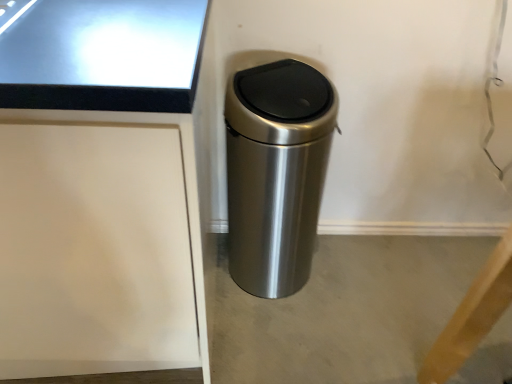
Where is `satin silver trash can at center`? satin silver trash can at center is located at coordinates tap(276, 172).

The width and height of the screenshot is (512, 384). What do you see at coordinates (276, 172) in the screenshot? I see `satin silver trash can at center` at bounding box center [276, 172].

Measure the distance between point [259,247] and camera.

The depth of point [259,247] is 3.98 feet.

In order to face satin silver trash can at center, should I rotate leftwards or rightwards?

A 2.745 degree turn to the right will do.

Image resolution: width=512 pixels, height=384 pixels. What do you see at coordinates (342, 310) in the screenshot?
I see `gray concrete at center` at bounding box center [342, 310].

Locate an element on the screen. This screenshot has height=384, width=512. gray concrete at center is located at coordinates (342, 310).

Locate an element on the screen. satin silver trash can at center is located at coordinates (276, 172).

Considering the relative positions of gray concrete at center and satin silver trash can at center in the image provided, is gray concrete at center to the right of satin silver trash can at center from the viewer's perspective?

Yes, gray concrete at center is to the right of satin silver trash can at center.

Who is more distant, gray concrete at center or satin silver trash can at center?

Positioned behind is gray concrete at center.

Does point (275, 341) come in front of point (259, 211)?

No, (275, 341) is further to viewer.

From the image's perspective, does gray concrete at center appear lower than satin silver trash can at center?

Yes.

From a real-world perspective, is gray concrete at center below satin silver trash can at center?

Correct, in the physical world, gray concrete at center is lower than satin silver trash can at center.

Considering the relative sizes of gray concrete at center and satin silver trash can at center in the image provided, is gray concrete at center wider than satin silver trash can at center?

Yes, gray concrete at center is wider than satin silver trash can at center.

Who is shorter, gray concrete at center or satin silver trash can at center?

gray concrete at center is shorter.

Consider the image. Considering the relative sizes of gray concrete at center and satin silver trash can at center in the image provided, is gray concrete at center bigger than satin silver trash can at center?

No.

Is gray concrete at center located outside satin silver trash can at center?

gray concrete at center lies outside satin silver trash can at center's area.

Is gray concrete at center far away from satin silver trash can at center?

That's not correct — gray concrete at center is a little close to satin silver trash can at center.

Based on the photo, is gray concrete at center looking in the opposite direction of satin silver trash can at center?

No, gray concrete at center is not facing away from satin silver trash can at center.

In the scene shown: How different are the orientations of gray concrete at center and satin silver trash can at center in degrees?

3.7 degrees.

Identify the location of concrete that is below the satin silver trash can at center (from the image's perspective). This screenshot has width=512, height=384. (342, 310).

Between satin silver trash can at center and gray concrete at center, which one appears on the left side from the viewer's perspective?

satin silver trash can at center is more to the left.

Is the position of satin silver trash can at center more distant than that of gray concrete at center?

No, satin silver trash can at center is closer to the camera.

Is point (288, 234) positioned behind point (310, 286)?

No, (288, 234) is in front of (310, 286).

From the image's perspective, is satin silver trash can at center under gray concrete at center?

No.

Looking at this image, from a real-world perspective, who is located lower, satin silver trash can at center or gray concrete at center?

gray concrete at center, from a real-world perspective.

Considering the sizes of objects satin silver trash can at center and gray concrete at center in the image provided, who is wider, satin silver trash can at center or gray concrete at center?

Wider between the two is gray concrete at center.

From the picture: Considering the sizes of objects satin silver trash can at center and gray concrete at center in the image provided, who is shorter, satin silver trash can at center or gray concrete at center?

gray concrete at center is shorter.

Is satin silver trash can at center bigger or smaller than gray concrete at center?

In the image, satin silver trash can at center appears to be larger than gray concrete at center.

Is satin silver trash can at center inside the boundaries of gray concrete at center, or outside?

satin silver trash can at center lies outside gray concrete at center.

Is satin silver trash can at center with gray concrete at center?

satin silver trash can at center and gray concrete at center are clearly separated.

Is satin silver trash can at center oriented away from gray concrete at center?

No.

Can you tell me how much satin silver trash can at center and gray concrete at center differ in facing direction?

They differ by 3.7 degrees in their facing directions.

This screenshot has height=384, width=512. I want to click on waste container in front of the gray concrete at center, so coord(276,172).

Where is `concrete below the satin silver trash can at center (from the image's perspective)`? concrete below the satin silver trash can at center (from the image's perspective) is located at coordinates (342, 310).

Identify the location of waste container in front of the gray concrete at center. (276, 172).